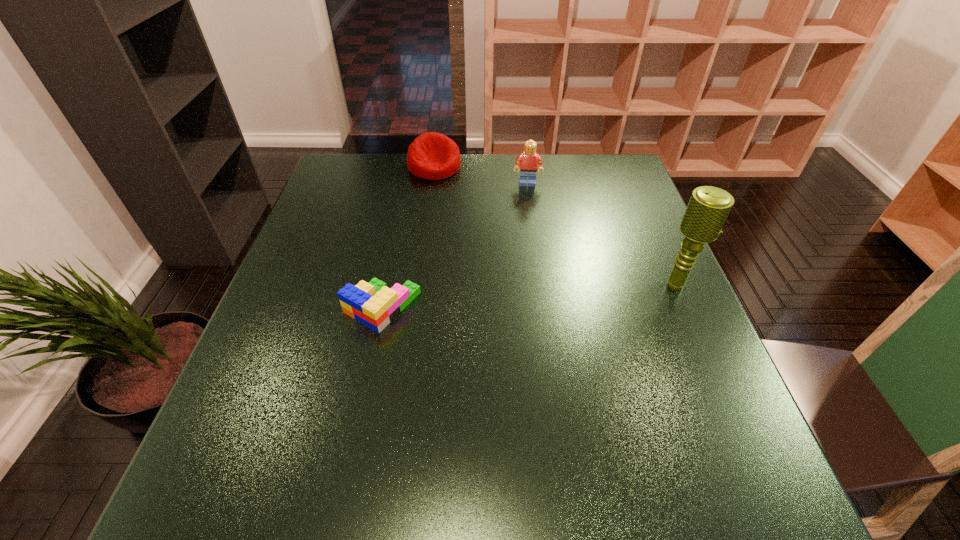
Where is `free spot at the near edge of the desktop`? The image size is (960, 540). free spot at the near edge of the desktop is located at coordinates (585, 409).

At what (x,y) coordinates should I click in order to perform the action: click on free location at the left edge of the desktop. Please return your answer as a coordinate pair (x, y). The width and height of the screenshot is (960, 540). Looking at the image, I should click on (318, 329).

In the image, there is a desktop. Identify the location of free region at the right edge. (662, 251).

Identify the location of vacant space at the near left corner of the desktop. (266, 437).

Image resolution: width=960 pixels, height=540 pixels. Identify the location of vacant region at the near right corner of the desktop. (735, 422).

I want to click on empty location between the beanbag and the farther Lego, so click(481, 175).

At what (x,y) coordinates should I click in order to perform the action: click on blank region between the nearer Lego and the third shortest object. Please return your answer as a coordinate pair (x, y). The height and width of the screenshot is (540, 960). Looking at the image, I should click on (455, 245).

Find the location of a particular element. vacant region between the beanbag and the nearer Lego is located at coordinates (408, 237).

Where is `free point between the rightmost object and the beanbag`? free point between the rightmost object and the beanbag is located at coordinates (555, 226).

Where is `free space between the beanbag and the third object from left to right`? free space between the beanbag and the third object from left to right is located at coordinates (481, 175).